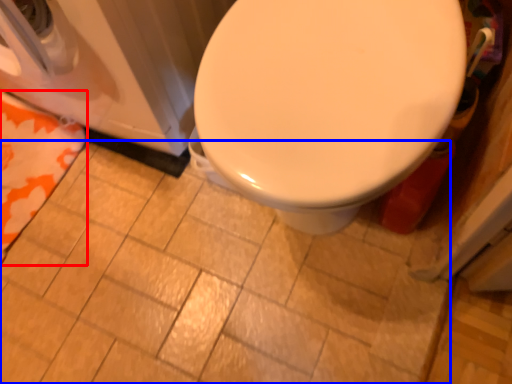
Question: Which object appears farthest to the camera in this image, beach towel (highlighted by a red box) or ceramic tile (highlighted by a blue box)?

Choices:
 (A) beach towel
 (B) ceramic tile

Answer: (A)